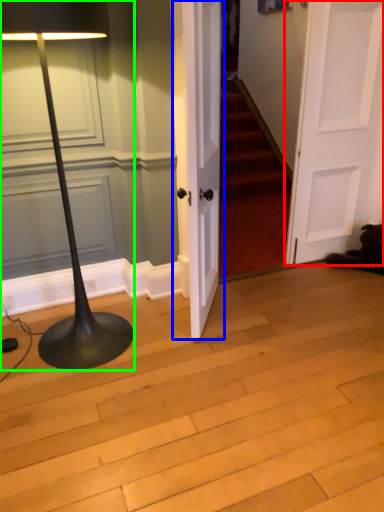
Question: Which object is the farthest from door (highlighted by a red box)? Choose among these: door (highlighted by a blue box) or lamp (highlighted by a green box).

Choices:
 (A) door
 (B) lamp

Answer: (B)